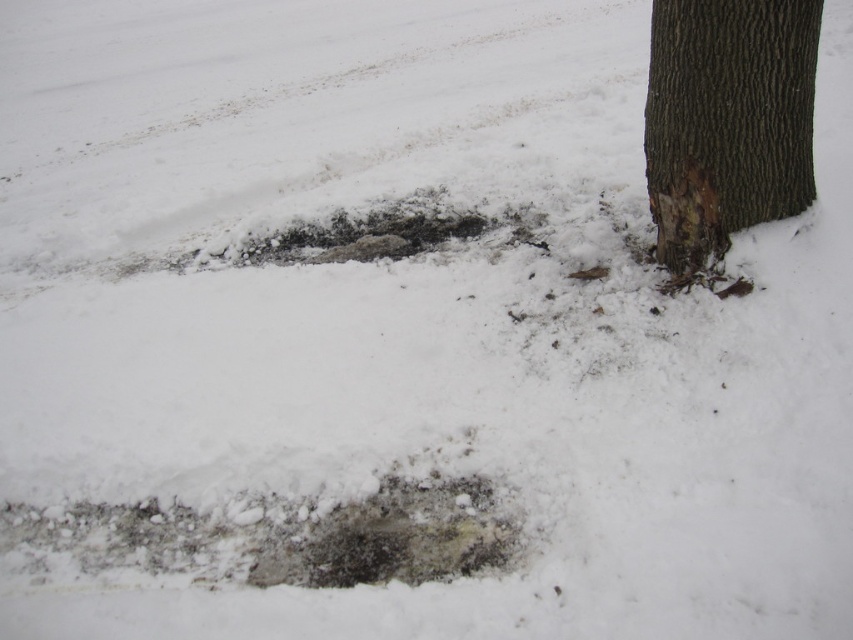
Question: Which of the following is the closest to the observer?

Choices:
 (A) (445, 516)
 (B) (729, 154)

Answer: (A)

Question: Can you confirm if brown rough bark at right is smaller than dark gray stone hole at center?

Choices:
 (A) yes
 (B) no

Answer: (B)

Question: Does brown rough bark at right have a smaller size compared to dark gray stone hole at center?

Choices:
 (A) no
 (B) yes

Answer: (A)

Question: Does brown rough bark at right appear under dark gray stone hole at center?

Choices:
 (A) yes
 (B) no

Answer: (B)

Question: Among these points, which one is nearest to the camera?

Choices:
 (A) (782, 204)
 (B) (498, 525)

Answer: (B)